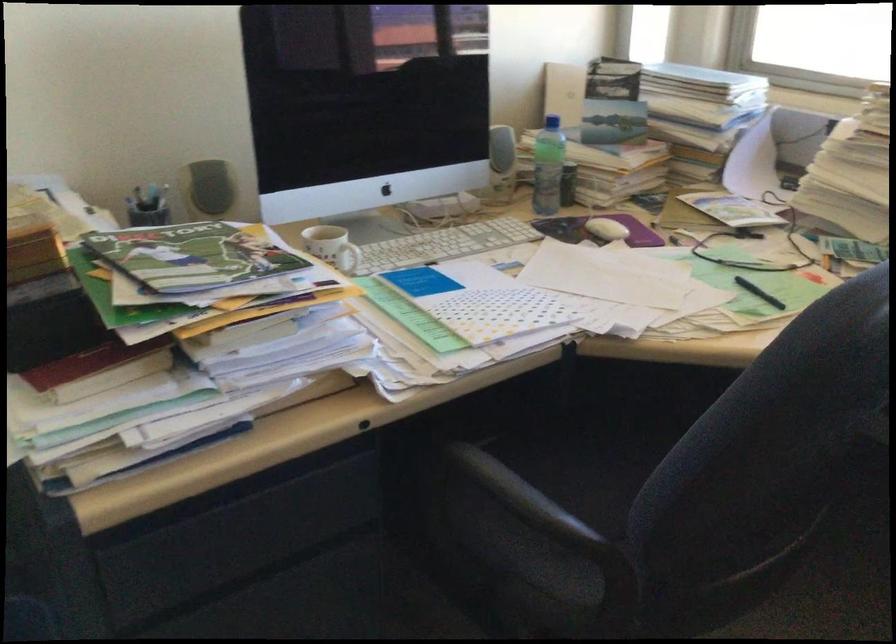
Describe the element at coordinates (348, 258) in the screenshot. I see `the white mug handle` at that location.